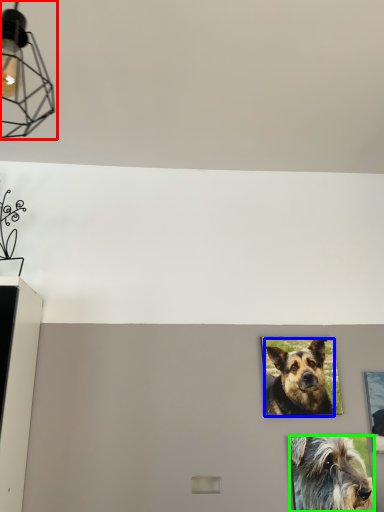
Question: Considering the real-world distances, which object is closest to light fixture (highlighted by a red box)? dog (highlighted by a blue box) or dog (highlighted by a green box).

Choices:
 (A) dog
 (B) dog

Answer: (A)